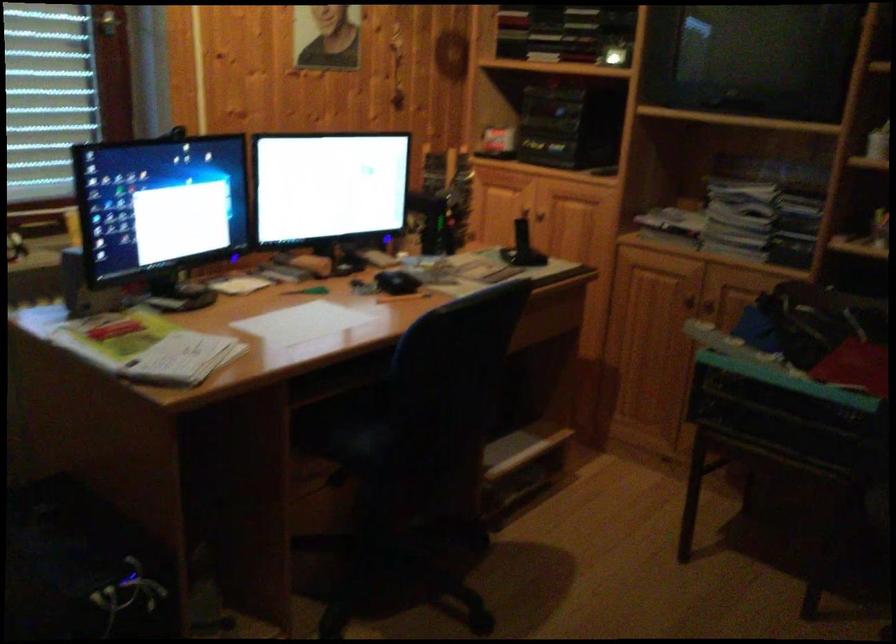
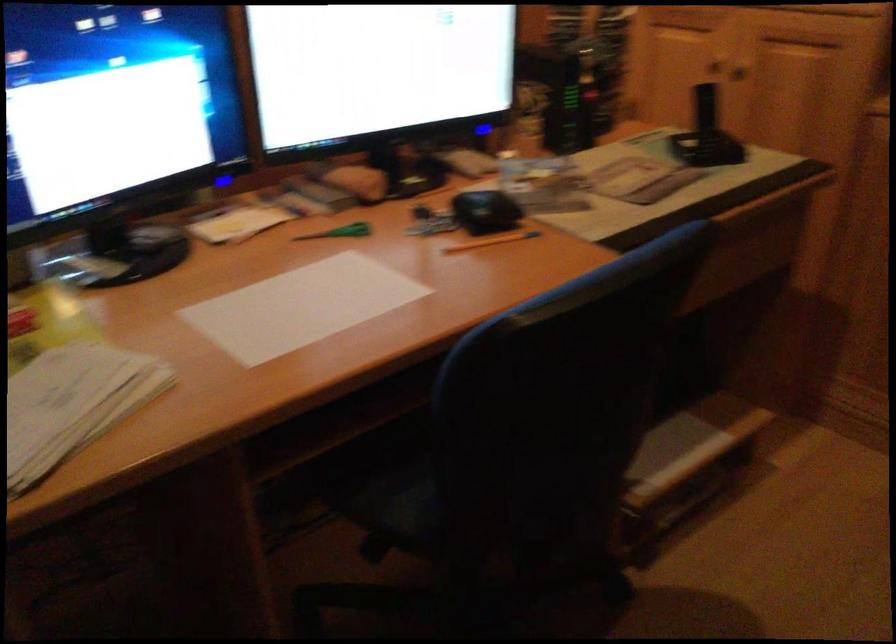
Locate, in the second image, the point that corresponds to point (401, 277) in the first image.

(486, 211)